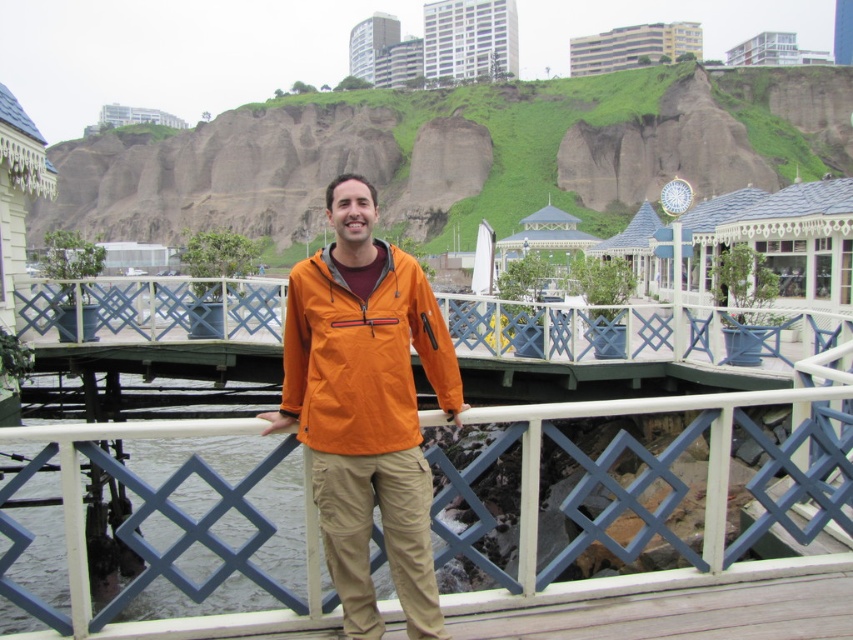
You are standing on the wooden pier and want to walk towards the two points marked in the scene. Which point, point (544, 444) or point (323, 308), is closer to you?

Point (544, 444) is closer to you because it is further to the viewer than point (323, 308).

You are a painter who wants to paint the white painted wood at center and the orange softshell jacket at center. Which object is positioned to the left of the other?

The white painted wood at center is to the left of the orange softshell jacket at center.